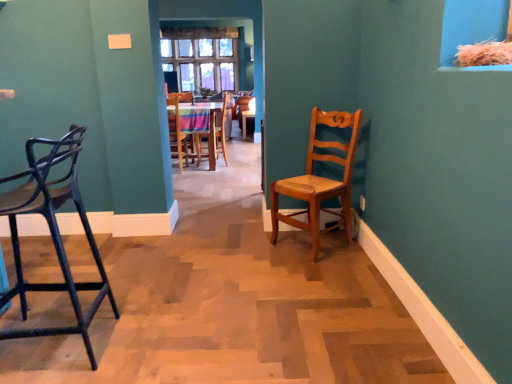
Where is `vacant area situated to the left side of light brown wooden chair at center, which ranks as the fourth chair in back-to-front order`? The image size is (512, 384). vacant area situated to the left side of light brown wooden chair at center, which ranks as the fourth chair in back-to-front order is located at coordinates (256, 243).